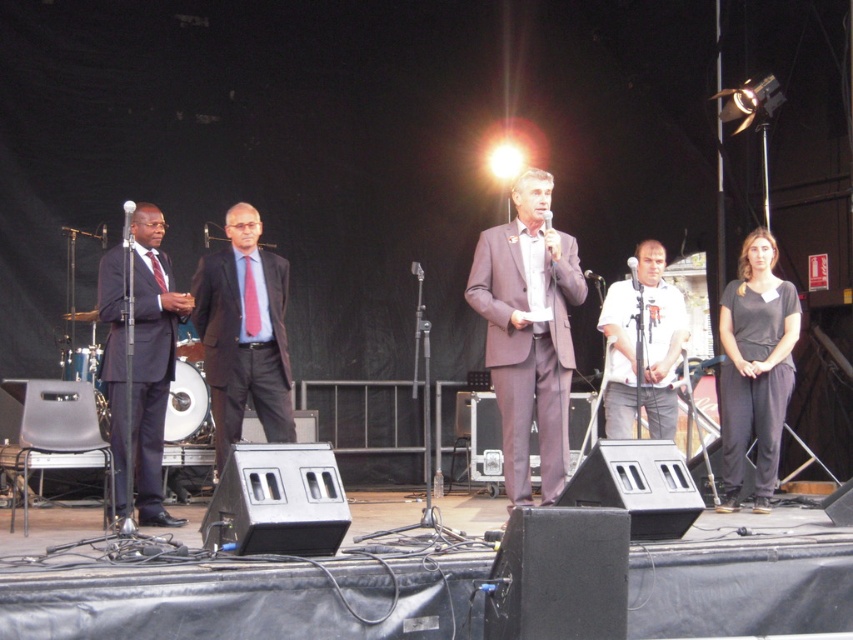
Is point (556, 308) positioned behind point (596, 284)?

No, it is not.

Can you confirm if gray suit at center is smaller than metallic silver microphone at center?

Incorrect, gray suit at center is not smaller in size than metallic silver microphone at center.

Is point (486, 305) positioned before point (585, 276)?

Yes, it is in front of point (585, 276).

This screenshot has height=640, width=853. What are the coordinates of `gray suit at center` in the screenshot? It's located at (527, 333).

Can you confirm if black matte microphone at left is positioned below metallic silver microphone at center?

Actually, black matte microphone at left is above metallic silver microphone at center.

Can you confirm if black matte microphone at left is positioned above metallic silver microphone at center?

Yes.

Locate an element on the screen. The height and width of the screenshot is (640, 853). black matte microphone at left is located at coordinates (126, 221).

Who is more distant from viewer, (548, 241) or (129, 221)?

Positioned behind is point (548, 241).

Does black plastic microphone at center come behind black matte microphone at left?

Yes.

Locate an element on the screen. The image size is (853, 640). black plastic microphone at center is located at coordinates (550, 236).